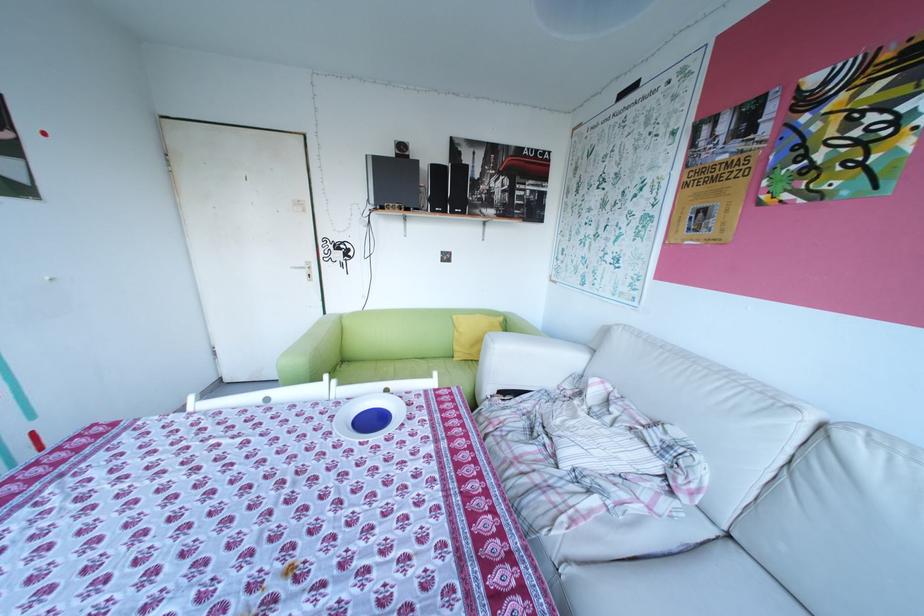
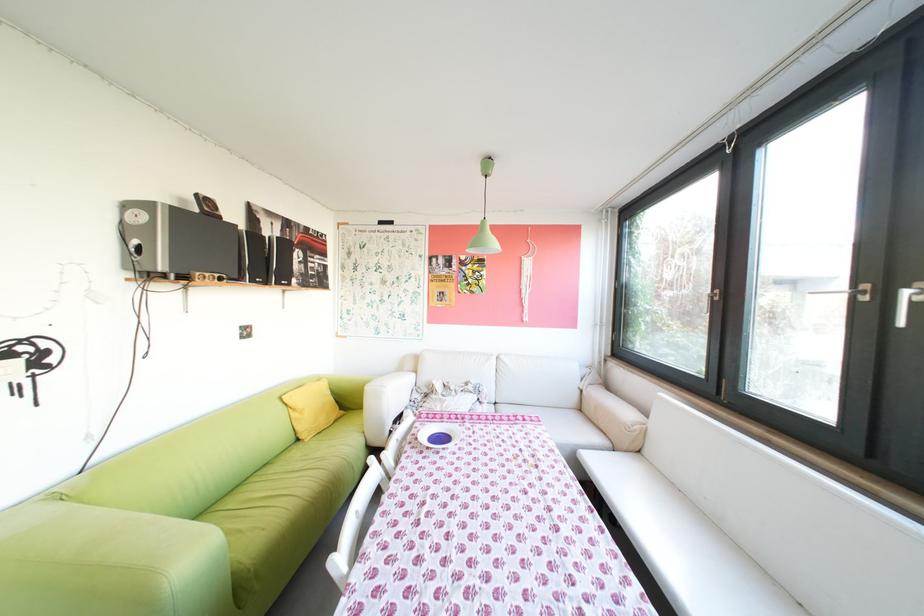
Where in the second image is the point corresponding to point (467, 452) from the first image?

(484, 419)